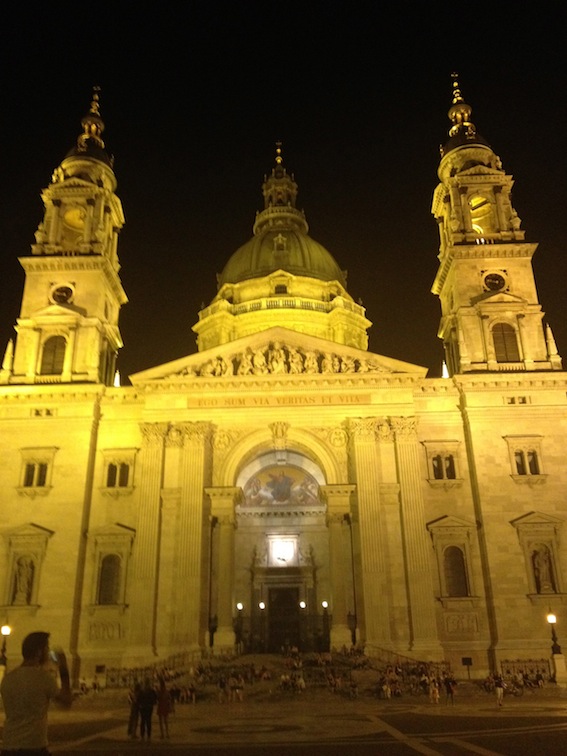
Locate an element on the screen. The height and width of the screenshot is (756, 567). lights is located at coordinates (222, 609).